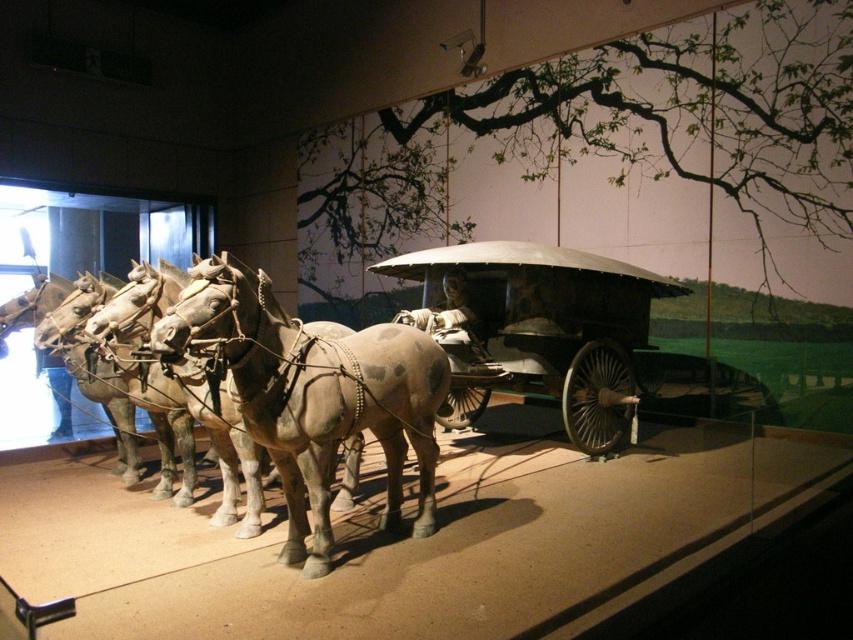
Consider the image. Is brown matte horse at center smaller than polished wood wagon at center?

Correct, brown matte horse at center occupies less space than polished wood wagon at center.

Looking at this image, who is positioned more to the right, brown matte horse at center or polished wood wagon at center?

polished wood wagon at center

Is point (292, 547) farther from viewer compared to point (503, 269)?

No, (292, 547) is closer to viewer.

Identify the location of brown matte horse at center. (312, 394).